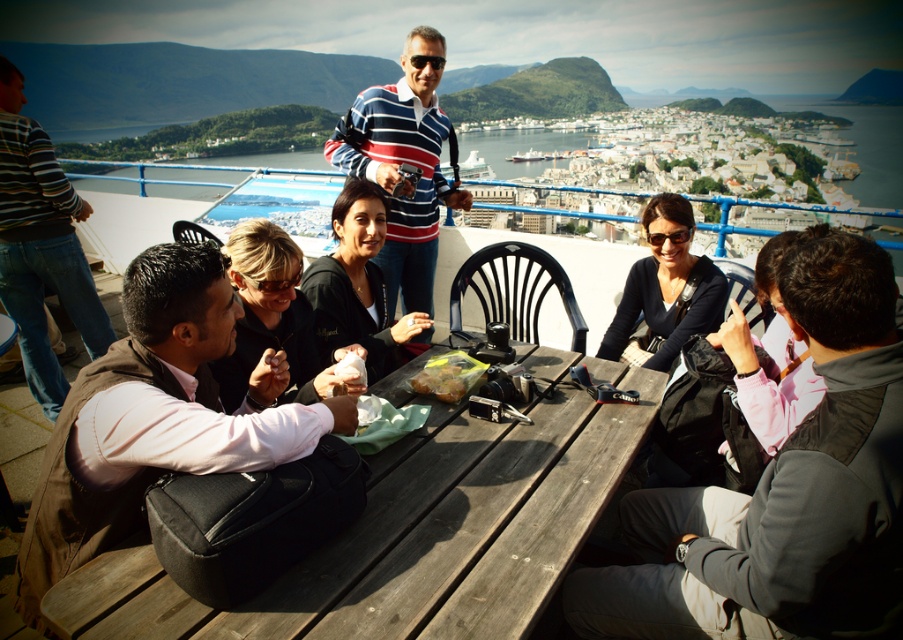
Between pink fabric shirt at upper center and striped sweater at left, which one appears on the left side from the viewer's perspective?

From the viewer's perspective, striped sweater at left appears more on the left side.

Does pink fabric shirt at upper center have a lesser height compared to striped sweater at left?

Yes, pink fabric shirt at upper center is shorter than striped sweater at left.

What do you see at coordinates (783, 490) in the screenshot?
I see `pink fabric shirt at upper center` at bounding box center [783, 490].

Find the location of a particular element. This screenshot has height=640, width=903. pink fabric shirt at upper center is located at coordinates (783, 490).

From the picture: Is the position of matte black jacket at center more distant than that of shiny plastic bag of food at center?

Yes.

Which is in front, point (359, 212) or point (426, 381)?

Positioned in front is point (426, 381).

Locate an element on the screen. This screenshot has width=903, height=640. matte black jacket at center is located at coordinates (358, 285).

Who is positioned more to the left, brown fabric vest at lower left or shiny plastic bag of food at center?

brown fabric vest at lower left

Where is `brown fabric vest at lower left`? Image resolution: width=903 pixels, height=640 pixels. brown fabric vest at lower left is located at coordinates (x=157, y=416).